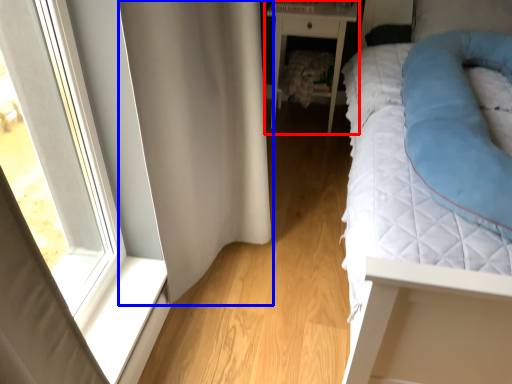
Question: Among these objects, which one is nearest to the camera, nightstand (highlighted by a red box) or curtain (highlighted by a blue box)?

Choices:
 (A) nightstand
 (B) curtain

Answer: (B)